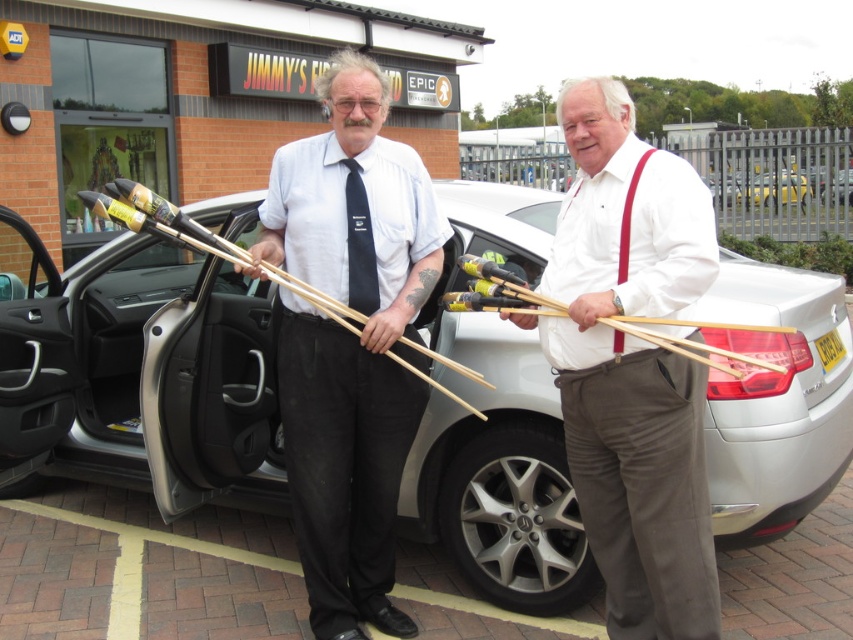
Does white matte shirt at center appear on the right side of white glossy sedan at center?

Incorrect, white matte shirt at center is not on the right side of white glossy sedan at center.

Is white matte shirt at center bigger than white glossy sedan at center?

Indeed, white matte shirt at center has a larger size compared to white glossy sedan at center.

Where is `white matte shirt at center`? This screenshot has width=853, height=640. white matte shirt at center is located at coordinates (631, 365).

I want to click on white matte shirt at center, so click(x=631, y=365).

Does white matte car at center appear under white matte shirt at center?

Incorrect, white matte car at center is not positioned below white matte shirt at center.

Measure the distance between point (160, 442) and camera.

Point (160, 442) and camera are 3.48 meters apart.

Locate an element on the screen. white matte car at center is located at coordinates (166, 371).

Who is positioned more to the left, white matte shirt at center or wooden sticks at center?

wooden sticks at center is more to the left.

Is point (616, 556) less distant than point (351, 504)?

Yes, it is in front of point (351, 504).

Image resolution: width=853 pixels, height=640 pixels. Find the location of `white matte shirt at center`. white matte shirt at center is located at coordinates (631, 365).